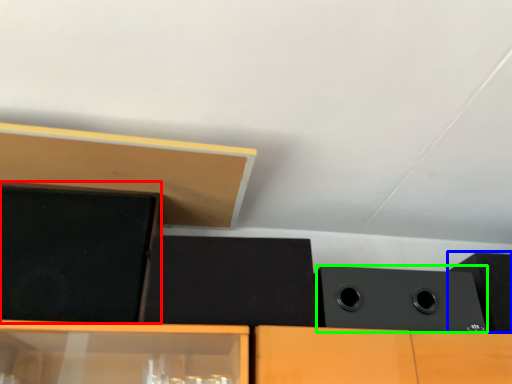
Question: Based on their relative distances, which object is farther from speaker (highlighted by a red box)? Choose from speaker (highlighted by a blue box) and speaker (highlighted by a green box).

Choices:
 (A) speaker
 (B) speaker

Answer: (A)